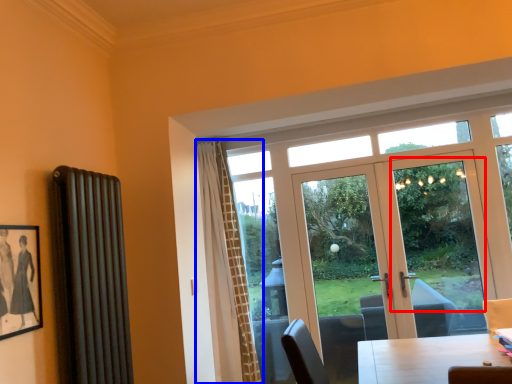
Question: Which object appears closest to the camera in this image, window screen (highlighted by a red box) or curtain (highlighted by a blue box)?

Choices:
 (A) window screen
 (B) curtain

Answer: (B)